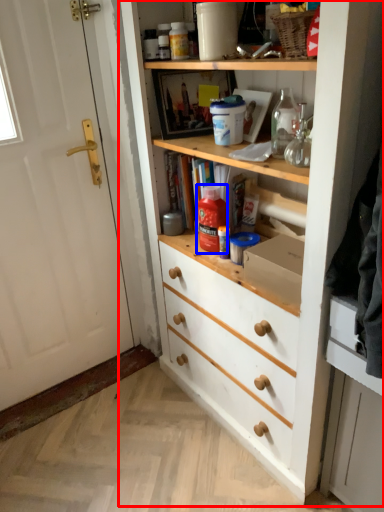
Question: Among these objects, which one is nearest to the camera, cupboard (highlighted by a red box) or bottle (highlighted by a blue box)?

Choices:
 (A) cupboard
 (B) bottle

Answer: (A)